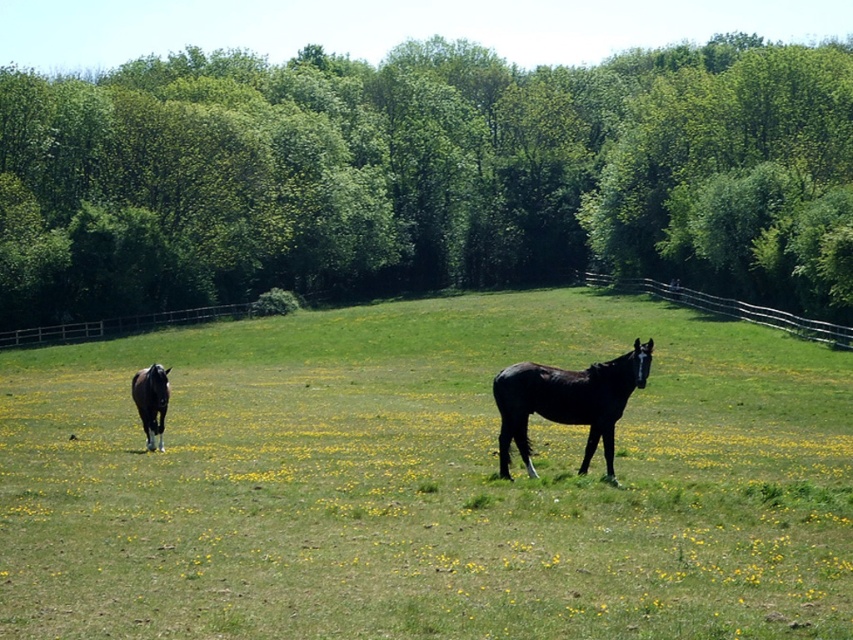
You are a photographer trying to capture both the black glossy horse at center and the shiny black horse at lower left in a single shot. Which horse will appear closer to the camera in the photo?

The black glossy horse at center will appear closer to the camera because it is positioned in front of the shiny black horse at lower left.

You are standing at the center of the field and see two points marked in the image. Which point is closer to you, point (610, 426) or point (672, 285)?

Point (610, 426) is in front of point (672, 285), so it is closer to you.

You are standing at the point marked as point [425,176] in the image. Looking around, what do you see directly in front of you?

You see green leafy trees at upper center directly in front of you at point [425,176].